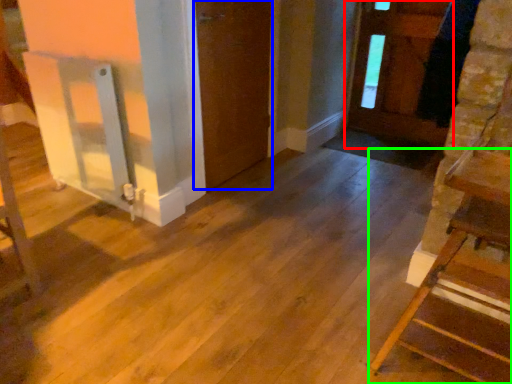
Question: Which is nearer to the door (highlighted by a red box)? door (highlighted by a blue box) or furniture (highlighted by a green box).

Choices:
 (A) door
 (B) furniture

Answer: (A)